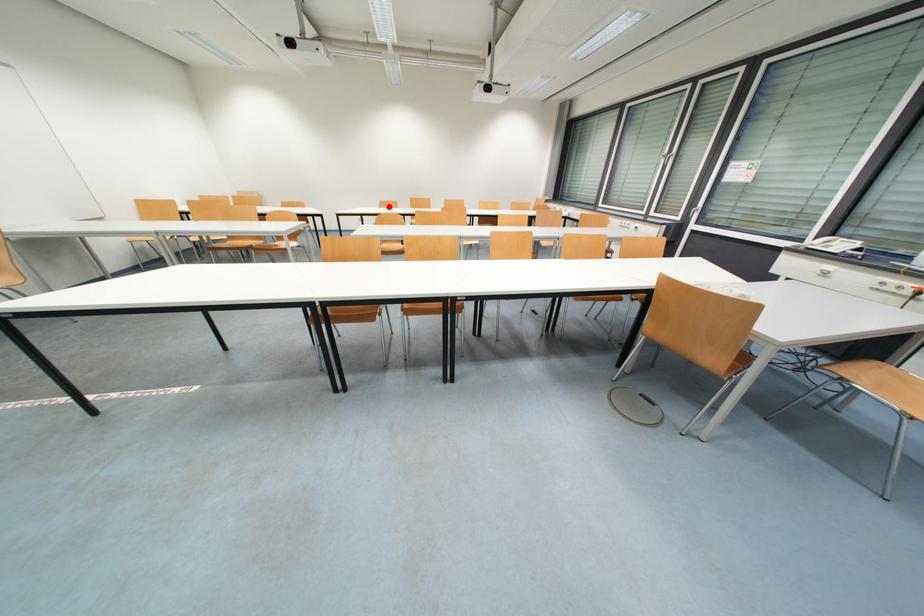
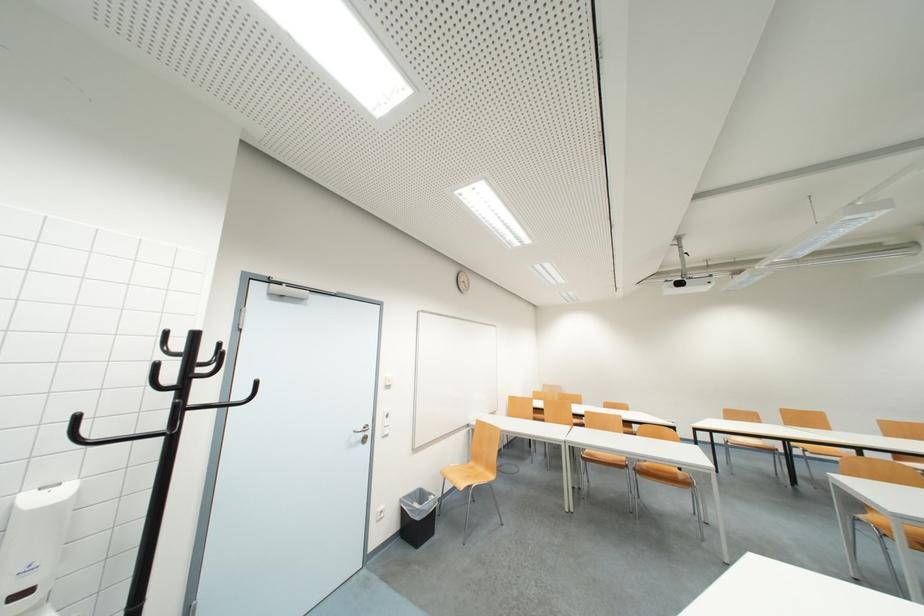
Find the pixel in the second image that matches the highlighted location in the first image.

(736, 416)